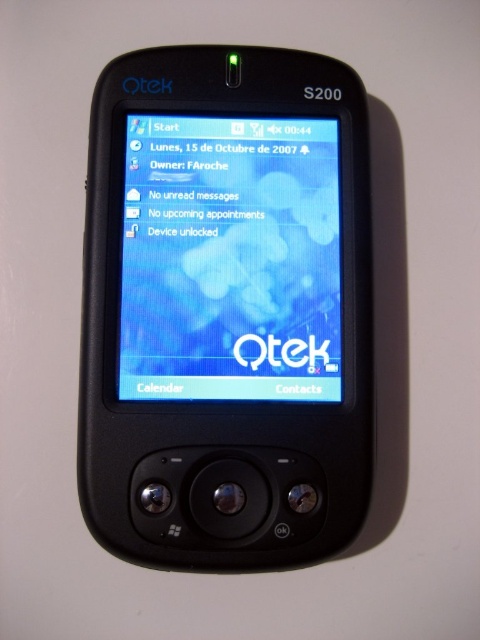
Question: Which of the following is the closest to the observer?

Choices:
 (A) matte plastic screen at center
 (B) black matte smartphone at center

Answer: (B)

Question: Does black matte smartphone at center appear on the left side of matte plastic screen at center?

Choices:
 (A) yes
 (B) no

Answer: (A)

Question: Which point is closer to the camera taking this photo?

Choices:
 (A) (250, 324)
 (B) (278, 445)

Answer: (B)

Question: Is black matte smartphone at center smaller than matte plastic screen at center?

Choices:
 (A) yes
 (B) no

Answer: (B)

Question: Which point is farther from the camera taking this photo?

Choices:
 (A) (226, 336)
 (B) (146, 337)

Answer: (A)

Question: Does black matte smartphone at center appear over matte plastic screen at center?

Choices:
 (A) yes
 (B) no

Answer: (B)